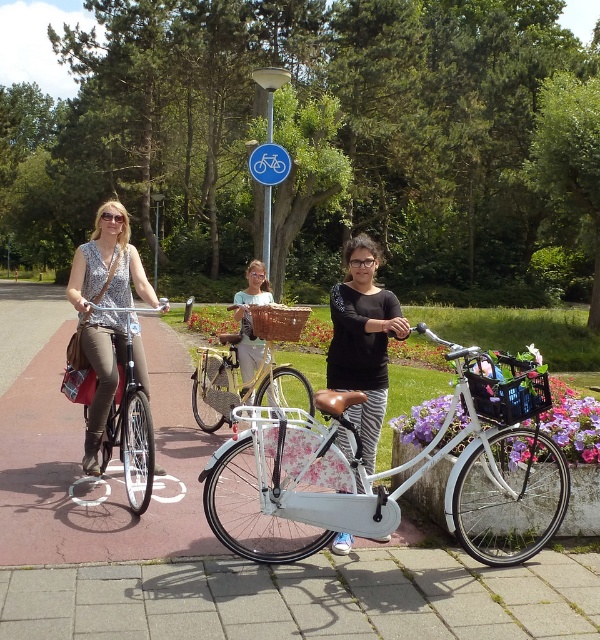
Looking at this image, does black jersey at center have a smaller size compared to blue plastic sign at upper center?

Actually, black jersey at center might be larger than blue plastic sign at upper center.

Who is taller, black jersey at center or blue plastic sign at upper center?

With more height is black jersey at center.

Which is in front, point (348, 369) or point (282, 177)?

Point (348, 369) is more forward.

Where is `black jersey at center`? This screenshot has height=640, width=600. black jersey at center is located at coordinates (363, 340).

Can you confirm if gray concrete pavement at lower center is smaller than black jersey at center?

Yes, gray concrete pavement at lower center is smaller than black jersey at center.

At what (x,y) coordinates should I click in order to perform the action: click on gray concrete pavement at lower center. Please return your answer as a coordinate pair (x, y). The width and height of the screenshot is (600, 640). Looking at the image, I should click on (307, 596).

Is point (232, 593) farther from camera compared to point (361, 369)?

That is False.

Image resolution: width=600 pixels, height=640 pixels. Find the location of `gray concrete pavement at lower center`. gray concrete pavement at lower center is located at coordinates (307, 596).

Who is positioned more to the right, matte black tank top at center or black jersey at center?

black jersey at center

Can you confirm if matte black tank top at center is taller than black jersey at center?

Indeed, matte black tank top at center has a greater height compared to black jersey at center.

Which is behind, point (103, 204) or point (352, 291)?

Positioned behind is point (103, 204).

Find the location of a particular element. This screenshot has height=640, width=600. matte black tank top at center is located at coordinates (105, 310).